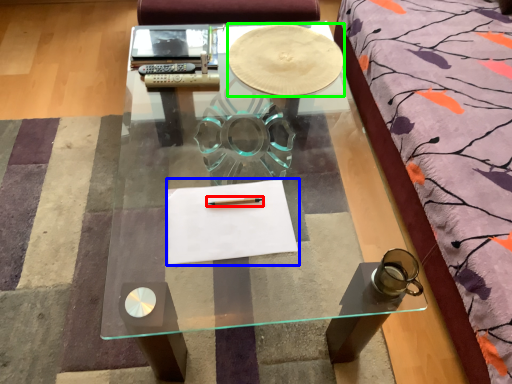
Question: Which object is the closest to the pencil (highlighted by a red box)? Choose among these: notebook (highlighted by a blue box) or round table (highlighted by a green box).

Choices:
 (A) notebook
 (B) round table

Answer: (A)